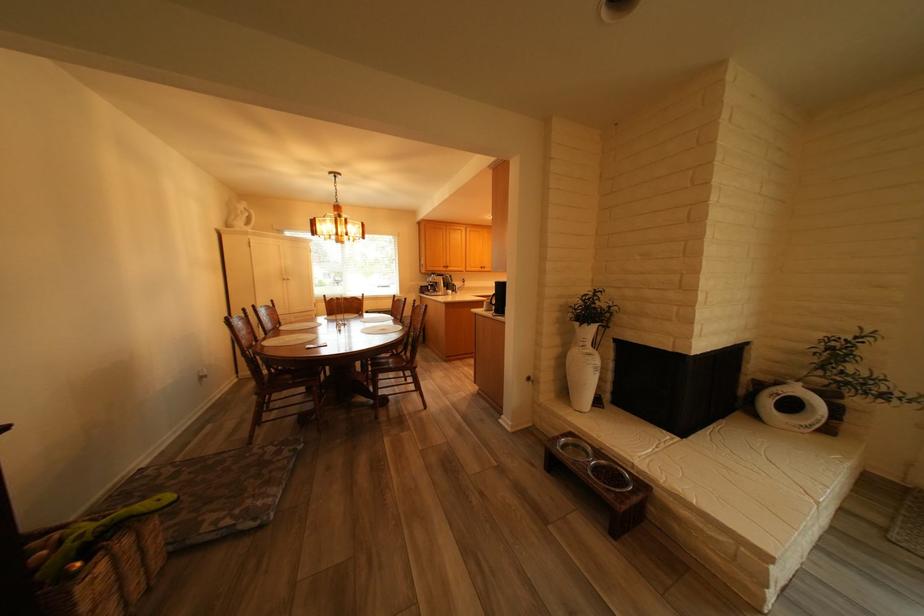
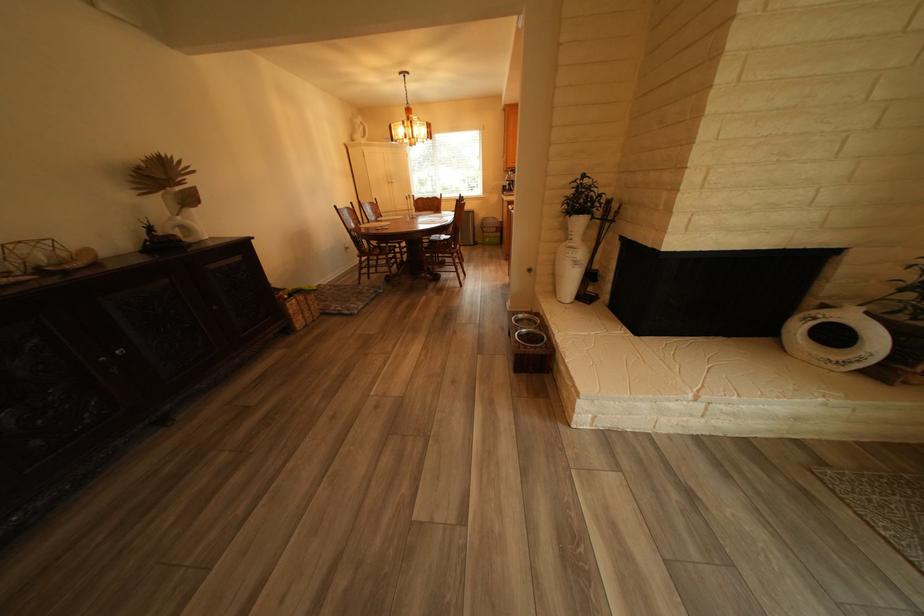
The point at (782,403) is marked in the first image. Where is the corresponding point in the second image?

(810, 329)